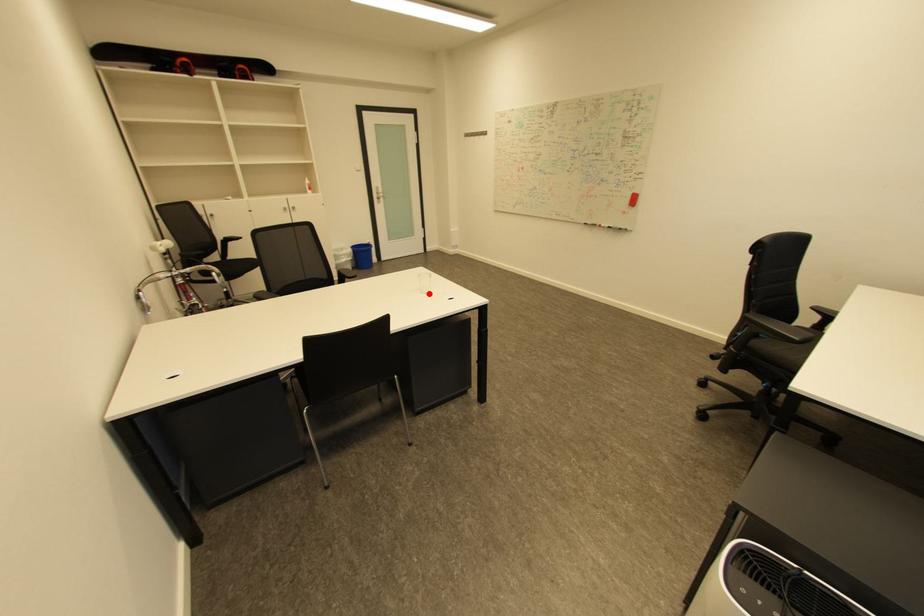
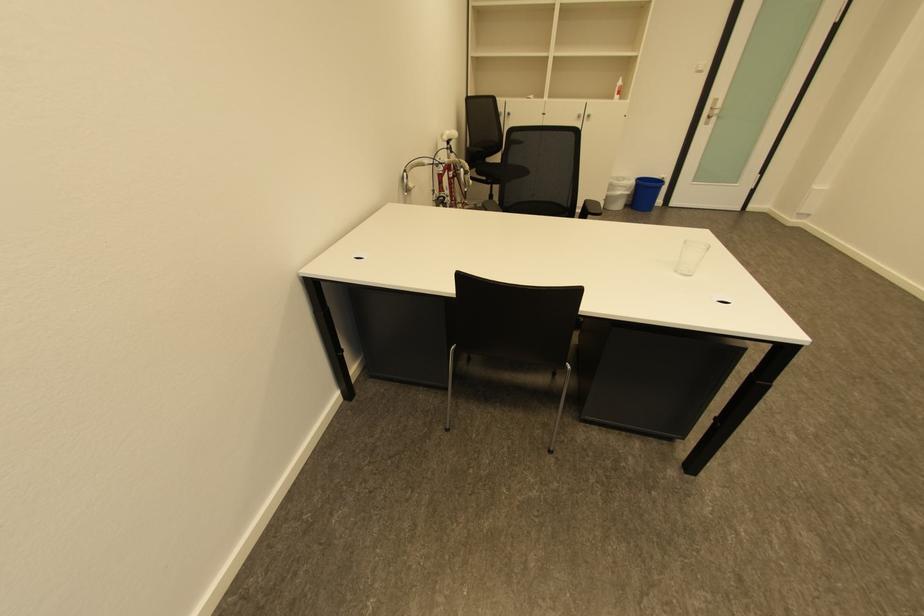
Where in the second image is the point corresponding to the highlighted location from the first image?

(684, 272)